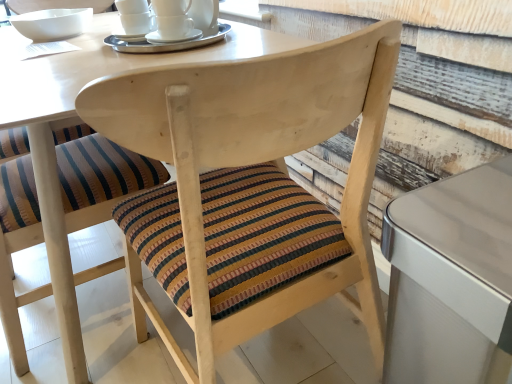
Question: In the image, is striped fabric cushion at center, the second chair in the right-to-left sequence, positioned in front of or behind wooden chair at center, arranged as the first chair when viewed from the right?

Choices:
 (A) front
 (B) behind

Answer: (B)

Question: In terms of size, does striped fabric cushion at center, the second chair in the right-to-left sequence, appear bigger or smaller than wooden chair at center, arranged as the first chair when viewed from the right?

Choices:
 (A) small
 (B) big

Answer: (A)

Question: Estimate the real-world distances between objects in this image. Which object is farther from the wooden chair at center, arranged as the first chair when viewed from the right?

Choices:
 (A) white ceramic bowl at upper left
 (B) metallic silver table at right
 (C) striped fabric cushion at center, the first chair positioned from the left
 (D) white ceramic cups at upper center

Answer: (A)

Question: Which object is the closest to the striped fabric cushion at center, the first chair positioned from the left?

Choices:
 (A) white ceramic bowl at upper left
 (B) metallic silver table at right
 (C) white ceramic cups at upper center
 (D) wooden chair at center, arranged as the first chair when viewed from the right

Answer: (D)